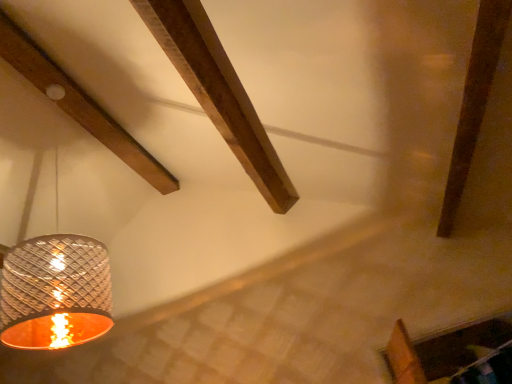
The width and height of the screenshot is (512, 384). Describe the element at coordinates (55, 292) in the screenshot. I see `metallic textured lampshade at left` at that location.

Consider the image. Measure the distance between point [14,340] and camera.

A distance of 5.21 feet exists between point [14,340] and camera.

This screenshot has height=384, width=512. Identify the location of metallic textured lampshade at left. (55, 292).

The image size is (512, 384). What do you see at coordinates (79, 104) in the screenshot?
I see `wooden beam at upper left` at bounding box center [79, 104].

Identify the location of wooden beam at upper left. The image size is (512, 384). (79, 104).

Measure the distance between wooden beam at upper left and camera.

wooden beam at upper left and camera are 5.85 feet apart.

Find the location of a particular element. metallic textured lampshade at left is located at coordinates (55, 292).

Which is more to the left, metallic textured lampshade at left or wooden beam at upper left?

wooden beam at upper left.

Is metallic textured lampshade at left behind wooden beam at upper left?

No, the depth of metallic textured lampshade at left is less than that of wooden beam at upper left.

Considering the positions of points (25, 281) and (31, 74), is point (25, 281) closer to camera compared to point (31, 74)?

Yes.

From the image's perspective, which object appears higher, metallic textured lampshade at left or wooden beam at upper left?

wooden beam at upper left appears higher in the image.

From a real-world perspective, is metallic textured lampshade at left positioned over wooden beam at upper left based on gravity?

No, from a real-world perspective, metallic textured lampshade at left is not above wooden beam at upper left.

Which object is thinner, metallic textured lampshade at left or wooden beam at upper left?

metallic textured lampshade at left is thinner.

Which of these two, metallic textured lampshade at left or wooden beam at upper left, stands shorter?

wooden beam at upper left is shorter.

Is metallic textured lampshade at left bigger than wooden beam at upper left?

Indeed, metallic textured lampshade at left has a larger size compared to wooden beam at upper left.

Can we say metallic textured lampshade at left lies outside wooden beam at upper left?

metallic textured lampshade at left is positioned outside wooden beam at upper left.

Is metallic textured lampshade at left far from wooden beam at upper left?

metallic textured lampshade at left is far away from wooden beam at upper left.

Is wooden beam at upper left at the back of metallic textured lampshade at left?

Yes, metallic textured lampshade at left is facing away from wooden beam at upper left.

Can you tell me how much metallic textured lampshade at left and wooden beam at upper left differ in facing direction?

The angle between the facing direction of metallic textured lampshade at left and the facing direction of wooden beam at upper left is 1.79 degrees.

Measure the distance between metallic textured lampshade at left and wooden beam at upper left.

1.06 meters.

Locate an element on the screen. This screenshot has width=512, height=384. plank on the left of metallic textured lampshade at left is located at coordinates (79, 104).

Considering the positions of objects wooden beam at upper left and metallic textured lampshade at left in the image provided, who is more to the right, wooden beam at upper left or metallic textured lampshade at left?

From the viewer's perspective, metallic textured lampshade at left appears more on the right side.

Which is in front, wooden beam at upper left or metallic textured lampshade at left?

metallic textured lampshade at left is in front.

Is point (7, 30) behind point (65, 262)?

That is True.

From the image's perspective, which one is positioned lower, wooden beam at upper left or metallic textured lampshade at left?

From the image's view, metallic textured lampshade at left is below.

From a real-world perspective, is wooden beam at upper left beneath metallic textured lampshade at left?

No, from a real-world perspective, wooden beam at upper left is not under metallic textured lampshade at left.

Which object is wider, wooden beam at upper left or metallic textured lampshade at left?

With larger width is wooden beam at upper left.

Does wooden beam at upper left have a greater height compared to metallic textured lampshade at left?

Incorrect, the height of wooden beam at upper left is not larger of that of metallic textured lampshade at left.

Looking at the image, does wooden beam at upper left seem bigger or smaller compared to metallic textured lampshade at left?

In the image, wooden beam at upper left appears to be smaller than metallic textured lampshade at left.

Would you say wooden beam at upper left is inside or outside metallic textured lampshade at left?

wooden beam at upper left lies outside metallic textured lampshade at left.

Is wooden beam at upper left next to metallic textured lampshade at left?

No, wooden beam at upper left is not touching metallic textured lampshade at left.

Is wooden beam at upper left aimed at metallic textured lampshade at left?

No, wooden beam at upper left is not facing towards metallic textured lampshade at left.

What's the angular difference between wooden beam at upper left and metallic textured lampshade at left's facing directions?

They differ by 1.79 degrees in their facing directions.

Image resolution: width=512 pixels, height=384 pixels. Find the location of `plank above the metallic textured lampshade at left (from the image's perspective)`. plank above the metallic textured lampshade at left (from the image's perspective) is located at coordinates (79, 104).

Locate an element on the screen. Image resolution: width=512 pixels, height=384 pixels. plank above the metallic textured lampshade at left (from the image's perspective) is located at coordinates (79, 104).

This screenshot has width=512, height=384. Identify the location of plank on the left of metallic textured lampshade at left. (79, 104).